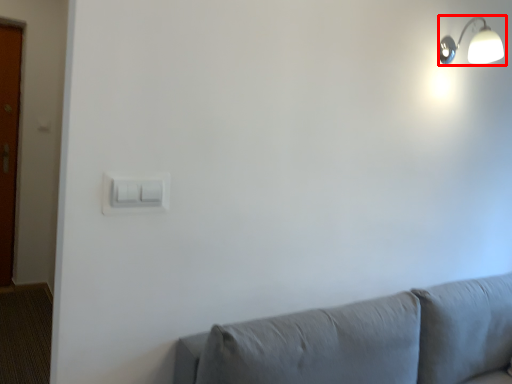
Question: Considering the relative positions of lamp (annotated by the red box) and light switch in the image provided, where is lamp (annotated by the red box) located with respect to the staircase?

Choices:
 (A) left
 (B) right

Answer: (B)